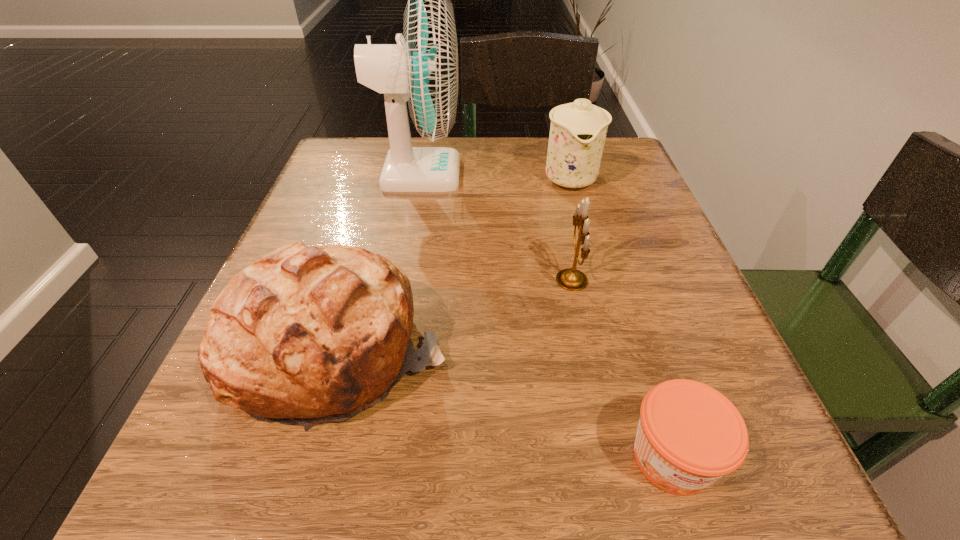
In order to click on vacant space at the near edge of the desktop in this screenshot , I will do `click(371, 516)`.

In order to click on vacant space at the right edge in this screenshot , I will do `click(623, 333)`.

Where is `free space at the far left corner`? The width and height of the screenshot is (960, 540). free space at the far left corner is located at coordinates (338, 182).

Identify the location of vacant space at the near left corner of the desktop. The height and width of the screenshot is (540, 960). (193, 449).

What are the coordinates of `free space between the bread and the chinaware` in the screenshot? It's located at (454, 263).

I want to click on vacant area that lies between the chinaware and the fan, so click(x=494, y=176).

This screenshot has width=960, height=540. I want to click on vacant area that lies between the candelabrum and the jam, so click(622, 369).

What are the coordinates of `vacant region between the shortest object and the bread` in the screenshot? It's located at (505, 403).

Where is `free spot between the bread and the chinaware`? free spot between the bread and the chinaware is located at coordinates (454, 263).

You are a GUI agent. You are given a task and a screenshot of the screen. Output one action in this format:
    pyautogui.click(x=<x>, y=<y>)
    Task: Click on the free space that is in between the shortest object and the tallest object
    This screenshot has height=540, width=960.
    Given the screenshot: What is the action you would take?
    pyautogui.click(x=545, y=315)